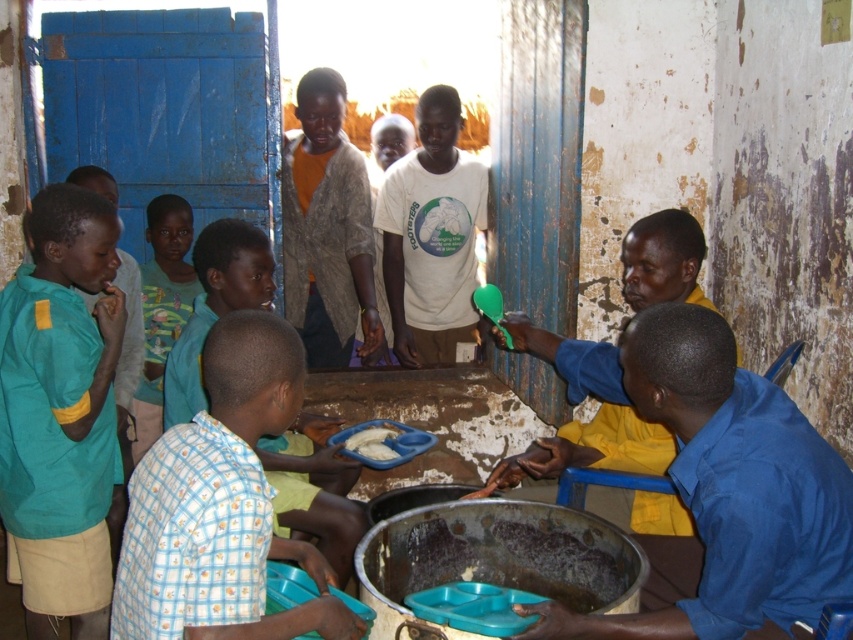
You are a photographer trying to capture a candid shot of the two individuals wearing the green fabric shirt at left and the light blue checkered shirt at center. Since you want to ensure both are clearly visible in the frame, which shirt should you focus on first to account for their sizes?

The green fabric shirt at left is thinner than the light blue checkered shirt at center. Therefore, you should focus on the light blue checkered shirt at center first because it is larger and might be easier to capture clearly, ensuring both are visible.